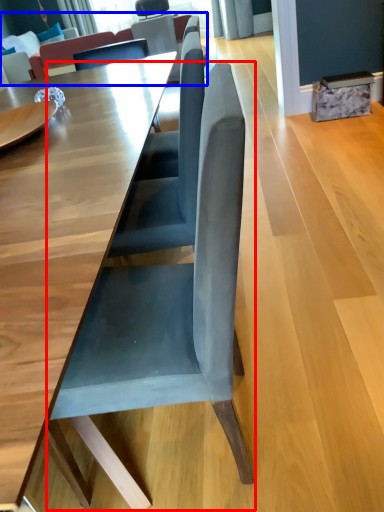
Question: Among these objects, which one is farthest to the camera, chair (highlighted by a red box) or couch (highlighted by a blue box)?

Choices:
 (A) chair
 (B) couch

Answer: (B)